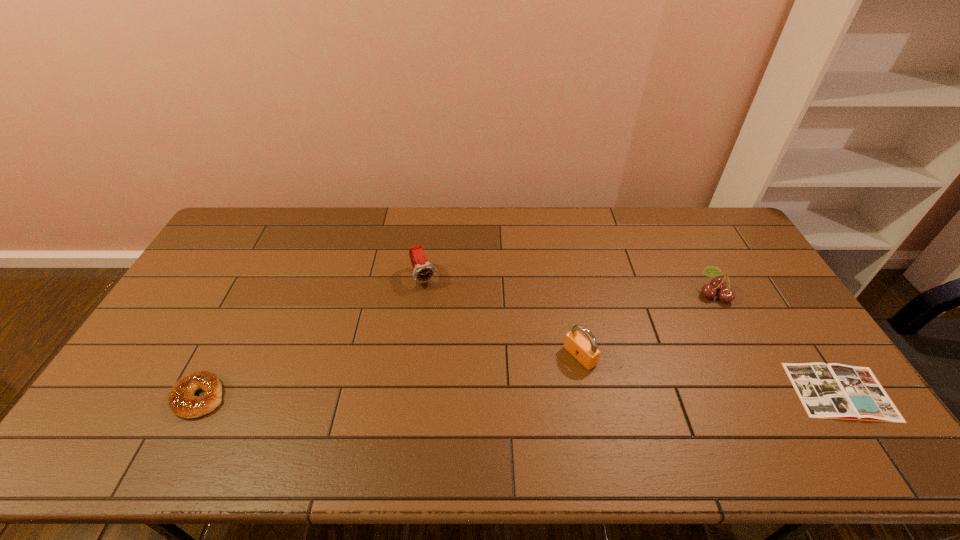
Find the location of a particular element. The width and height of the screenshot is (960, 540). vacant space at the far left corner is located at coordinates (x=253, y=241).

The height and width of the screenshot is (540, 960). What are the coordinates of `vacant space at the near right corner` in the screenshot? It's located at (799, 402).

Where is `empty location between the second shortest object and the third object from right to left`? The height and width of the screenshot is (540, 960). empty location between the second shortest object and the third object from right to left is located at coordinates (390, 376).

Image resolution: width=960 pixels, height=540 pixels. I want to click on vacant space that's between the padlock and the third tallest object, so click(x=646, y=326).

This screenshot has height=540, width=960. What are the coordinates of `free space between the cherry and the padlock` in the screenshot? It's located at (646, 326).

Locate an element on the screen. The height and width of the screenshot is (540, 960). empty space between the bagel and the rightmost object is located at coordinates (520, 394).

The height and width of the screenshot is (540, 960). What are the coordinates of `vacant area that lies between the cherry and the fourth object from right to left` in the screenshot? It's located at (x=568, y=286).

Identify the location of blank region between the second object from left to right and the bagel. The width and height of the screenshot is (960, 540). (312, 337).

At what (x,y) coordinates should I click in order to perform the action: click on free space between the watch and the padlock. Please return your answer as a coordinate pair (x, y). This screenshot has width=960, height=540. Looking at the image, I should click on (502, 316).

Image resolution: width=960 pixels, height=540 pixels. I want to click on free spot between the third object from left to right and the rightmost object, so click(710, 374).